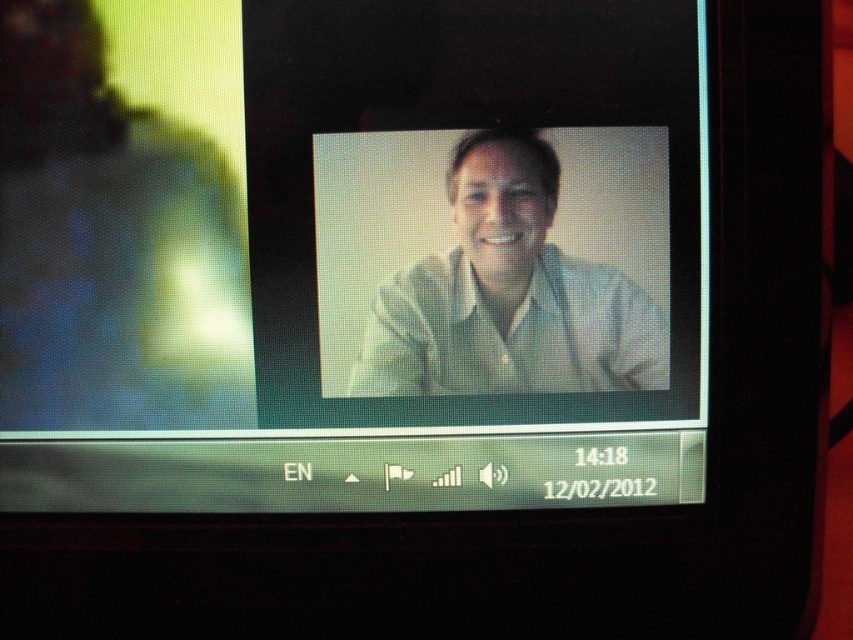
Question: Is matte white monitor at center wider than white matte shirt at center?

Choices:
 (A) yes
 (B) no

Answer: (A)

Question: Can you confirm if matte white monitor at center is positioned above white matte shirt at center?

Choices:
 (A) no
 (B) yes

Answer: (B)

Question: Which object appears closest to the camera in this image?

Choices:
 (A) matte white monitor at center
 (B) white matte shirt at center

Answer: (A)

Question: Can you confirm if matte white monitor at center is positioned to the left of white matte shirt at center?

Choices:
 (A) no
 (B) yes

Answer: (B)